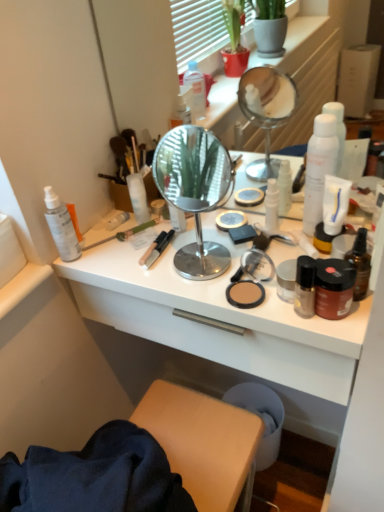
You are a GUI agent. You are given a task and a screenshot of the screen. Output one action in this format:
    pyautogui.click(x=<x>, y=<y>)
    Task: Click on the vacant space in between polished chrome mirror at center and translucent plastic spray bottle at left, the 1th toiletry when ordered from left to right
    
    Given the screenshot: What is the action you would take?
    pyautogui.click(x=129, y=258)